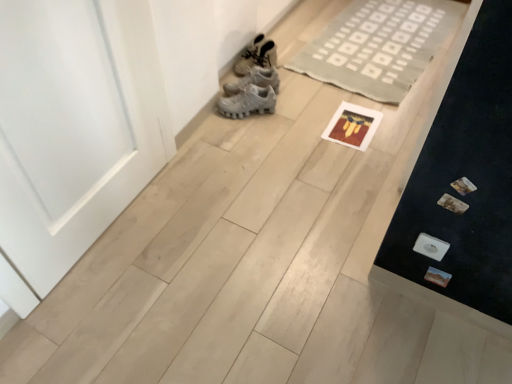
Question: Is neutral woven rug at upper center positioned with its back to white matte sneakers at upper center?

Choices:
 (A) yes
 (B) no

Answer: (B)

Question: Does neutral woven rug at upper center come behind white matte sneakers at upper center?

Choices:
 (A) no
 (B) yes

Answer: (A)

Question: Is neutral woven rug at upper center far away from white matte sneakers at upper center?

Choices:
 (A) yes
 (B) no

Answer: (B)

Question: Is white matte sneakers at upper center surrounded by neutral woven rug at upper center?

Choices:
 (A) no
 (B) yes

Answer: (A)

Question: Considering the relative sizes of neutral woven rug at upper center and white matte sneakers at upper center in the image provided, is neutral woven rug at upper center bigger than white matte sneakers at upper center?

Choices:
 (A) yes
 (B) no

Answer: (A)

Question: From their relative heights in the image, would you say neutral woven rug at upper center is taller or shorter than white matte sneakers at upper center?

Choices:
 (A) short
 (B) tall

Answer: (A)

Question: Does point (402, 62) appear closer or farther from the camera than point (269, 44)?

Choices:
 (A) closer
 (B) farther

Answer: (B)

Question: Based on their positions, is neutral woven rug at upper center located to the left or right of white matte sneakers at upper center?

Choices:
 (A) left
 (B) right

Answer: (B)

Question: Would you say neutral woven rug at upper center is inside or outside white matte sneakers at upper center?

Choices:
 (A) outside
 (B) inside

Answer: (A)

Question: Choose the correct answer: Is white matte sneakers at upper center inside neutral woven rug at upper center or outside it?

Choices:
 (A) outside
 (B) inside

Answer: (A)

Question: Based on their sizes in the image, would you say white matte sneakers at upper center is bigger or smaller than neutral woven rug at upper center?

Choices:
 (A) big
 (B) small

Answer: (B)

Question: From the image's perspective, is white matte sneakers at upper center above or below neutral woven rug at upper center?

Choices:
 (A) below
 (B) above

Answer: (A)

Question: Is point (264, 46) positioned closer to the camera than point (355, 54)?

Choices:
 (A) farther
 (B) closer

Answer: (B)

Question: Considering their positions, is neutral woven rug at upper center located in front of or behind white matte door at left?

Choices:
 (A) behind
 (B) front

Answer: (A)

Question: From a real-world perspective, is neutral woven rug at upper center above or below white matte door at left?

Choices:
 (A) above
 (B) below

Answer: (B)